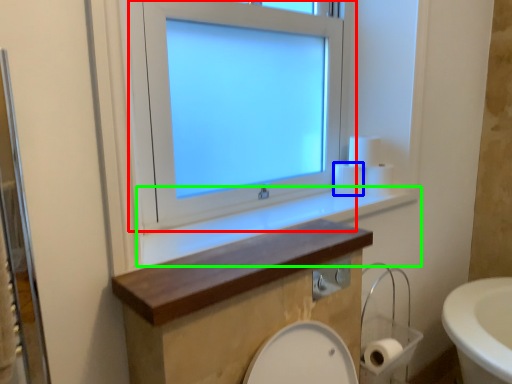
Question: Estimate the real-world distances between objects in this image. Which object is closer to window (highlighted by a red box), toilet paper (highlighted by a blue box) or window sill (highlighted by a green box)?

Choices:
 (A) toilet paper
 (B) window sill

Answer: (B)